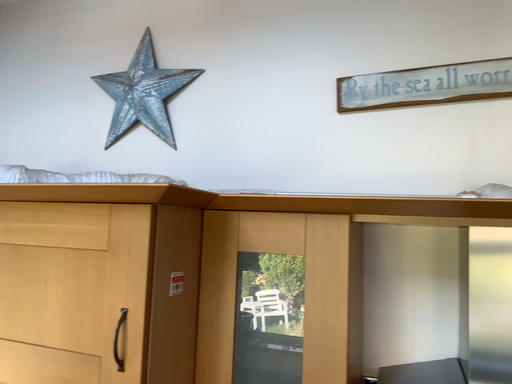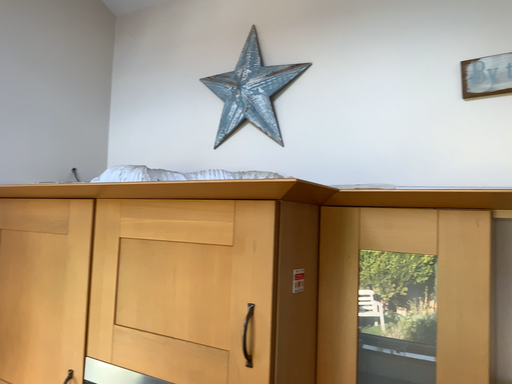
Question: How did the camera likely rotate when shooting the video?

Choices:
 (A) rotated right
 (B) rotated left

Answer: (B)